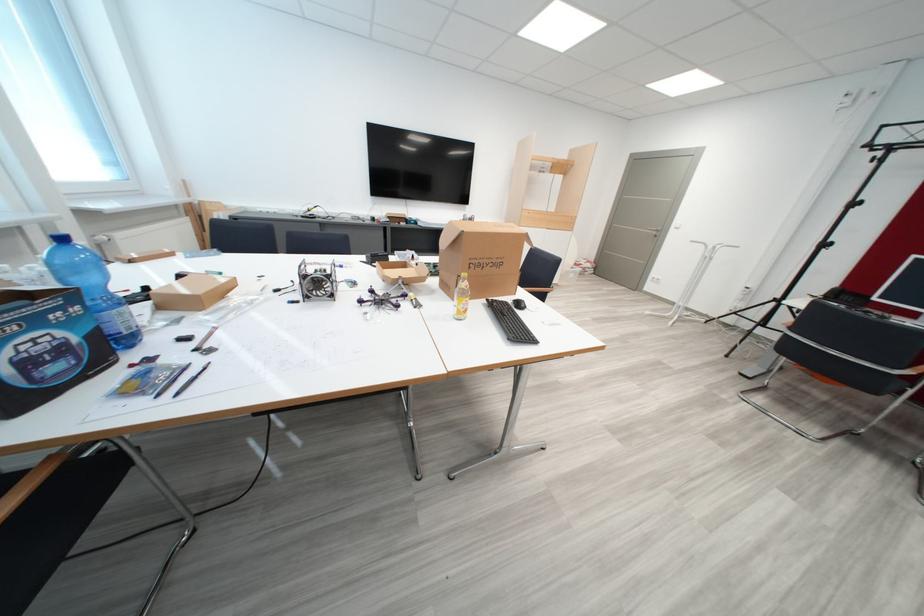
Image resolution: width=924 pixels, height=616 pixels. I want to click on metal fan assembly, so point(317,280).